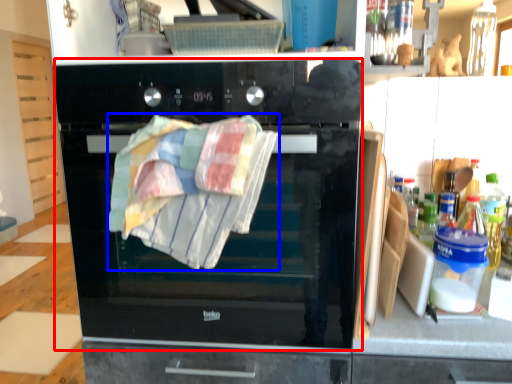
Question: Which object is closer to the camera taking this photo, oven (highlighted by a red box) or beach towel (highlighted by a blue box)?

Choices:
 (A) oven
 (B) beach towel

Answer: (B)